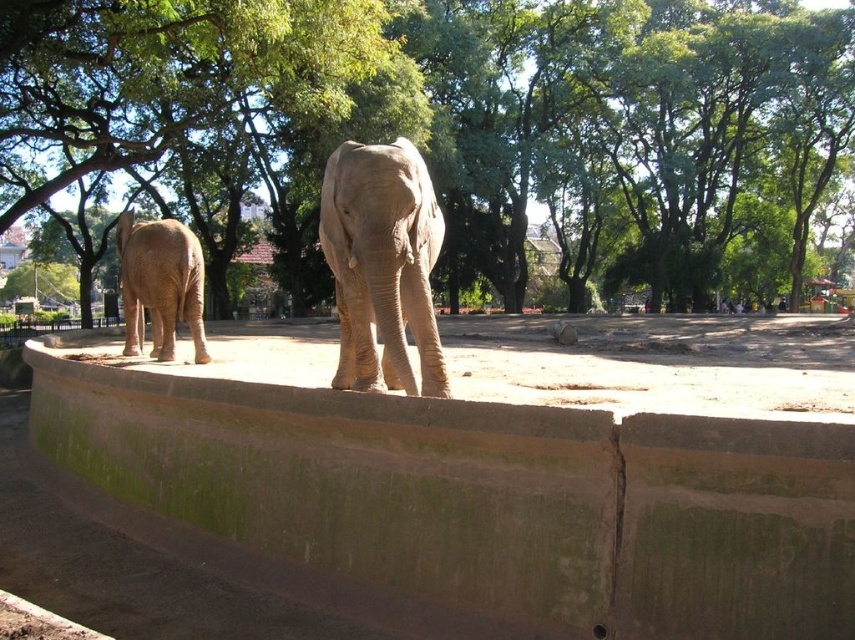
Question: Does green leafy tree at upper left have a smaller size compared to gray textured elephant at center?

Choices:
 (A) no
 (B) yes

Answer: (A)

Question: Can you confirm if green leafy tree at center is positioned to the right of matte brown elephant at left?

Choices:
 (A) yes
 (B) no

Answer: (A)

Question: Among these objects, which one is farthest from the camera?

Choices:
 (A) green leafy tree at center
 (B) smooth brown elephant at center

Answer: (B)

Question: Estimate the real-world distances between objects in this image. Which object is closer to the gray textured elephant at center?

Choices:
 (A) smooth brown elephant at center
 (B) matte brown elephant at left
 (C) green leafy tree at center
 (D) green leafy tree at upper left

Answer: (B)

Question: Based on their relative distances, which object is farther from the green leafy tree at upper left?

Choices:
 (A) gray textured elephant at center
 (B) matte brown elephant at left
 (C) green leafy tree at center
 (D) smooth brown elephant at center

Answer: (D)

Question: Is green leafy tree at upper left below smooth brown elephant at center?

Choices:
 (A) yes
 (B) no

Answer: (B)